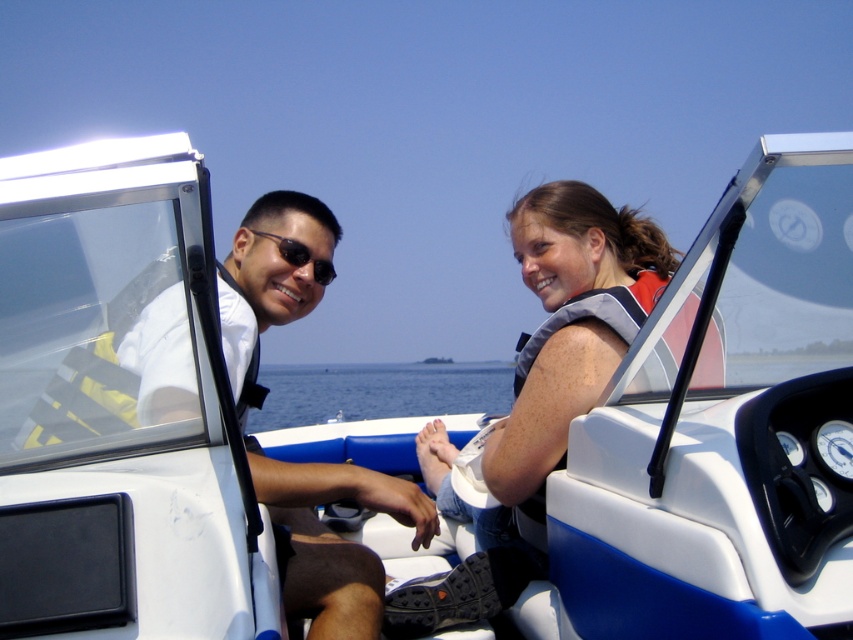
Is the position of matte white shirt at center less distant than that of blue water at center?

Yes, matte white shirt at center is in front of blue water at center.

Who is more forward, (309, 493) or (368, 372)?

Positioned in front is point (309, 493).

You are a GUI agent. You are given a task and a screenshot of the screen. Output one action in this format:
    pyautogui.click(x=<x>, y=<y>)
    Task: Click on the matte white shirt at center
    Image resolution: width=853 pixels, height=640 pixels.
    Given the screenshot: What is the action you would take?
    pyautogui.click(x=334, y=540)

From the picture: Who is more forward, [590,227] or [279,237]?

Point [279,237]

Describe the element at coordinates (535, 397) in the screenshot. I see `gray fabric life vest at center` at that location.

At what (x,y) coordinates should I click in order to perform the action: click on gray fabric life vest at center. Please return your answer as a coordinate pair (x, y). Looking at the image, I should click on (535, 397).

From the picture: Does matte white shirt at center appear over matte black sunglasses at center?

No, matte white shirt at center is not above matte black sunglasses at center.

Who is more distant from viewer, (260, 285) or (291, 246)?

Positioned behind is point (291, 246).

Does point (148, 396) come farther from viewer compared to point (283, 252)?

No, (148, 396) is closer to viewer.

This screenshot has height=640, width=853. Identify the location of matte white shirt at center. pos(334,540).